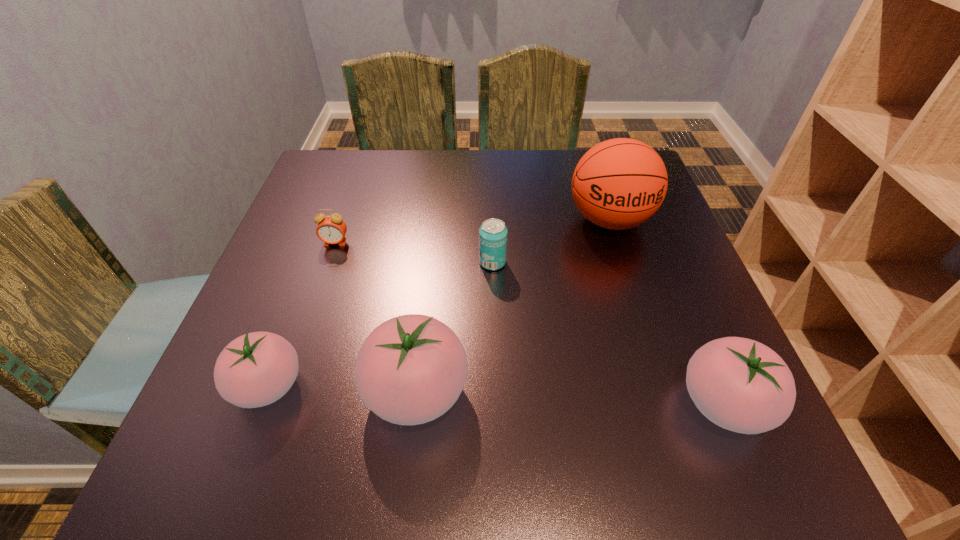
In order to click on tomato that is the closest to the basketball in this screenshot , I will do `click(739, 384)`.

Find the location of `tomato that can be found as the closest to the leftmost tomato`. tomato that can be found as the closest to the leftmost tomato is located at coordinates (411, 369).

This screenshot has height=540, width=960. Identify the location of free point that satisfies the following two spatial constraints: 1. on the side with logo of the tallest object; 2. on the left side of the second shortest tomato. (668, 404).

I want to click on vacant area in the image that satisfies the following two spatial constraints: 1. on the face of the alarm clock; 2. on the right side of the beer can, so click(x=328, y=262).

Where is `vacant area that satisfies the following two spatial constraints: 1. on the back side of the fourth nearest object; 2. on the right side of the leftmost tomato`? vacant area that satisfies the following two spatial constraints: 1. on the back side of the fourth nearest object; 2. on the right side of the leftmost tomato is located at coordinates (315, 262).

Locate an element on the screen. This screenshot has width=960, height=540. vacant space that satisfies the following two spatial constraints: 1. on the side with logo of the basketball; 2. on the left side of the rightmost tomato is located at coordinates 668,404.

In order to click on free region that satisfies the following two spatial constraints: 1. on the face of the rightmost tomato; 2. on the right side of the alarm clock in this screenshot , I will do click(280, 404).

The image size is (960, 540). Identify the location of vacant area in the image that satisfies the following two spatial constraints: 1. on the face of the alarm clock; 2. on the right side of the rightmost tomato. (280, 404).